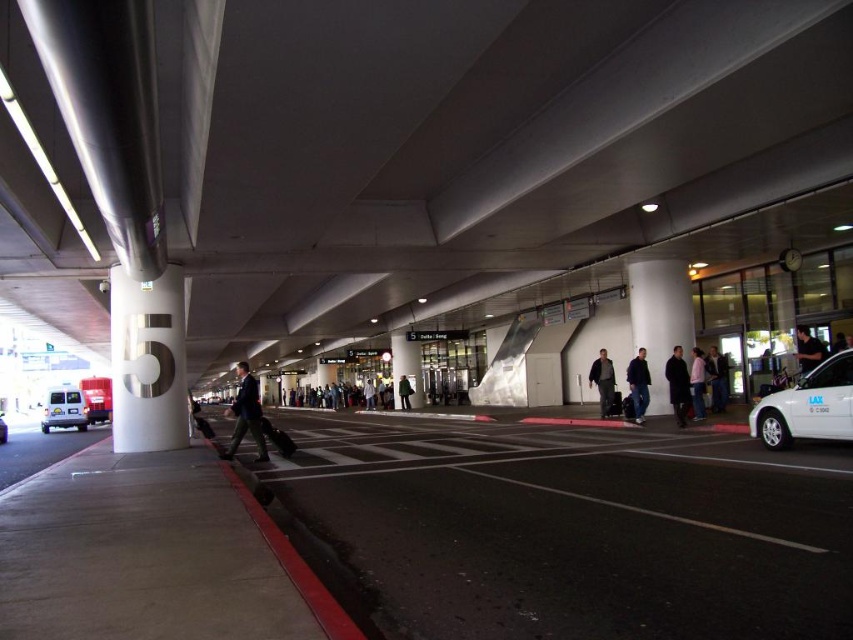
You are a traveler at the airport terminal. You notice two items on the floor near the center of the walkway. One is light blue jeans at center and the other is black leather jacket at center. Which item is positioned more to the left side?

The light blue jeans at center is positioned to the left of the black leather jacket at center, so the light blue jeans at center is more to the left.

In the scene shown: You are a traveler at the airport terminal. You see the black asphalt at center and the dark blue suit at center. Which object takes up more space in the image?

The dark blue suit at center takes up more space in the image because it is larger than the black asphalt at center.